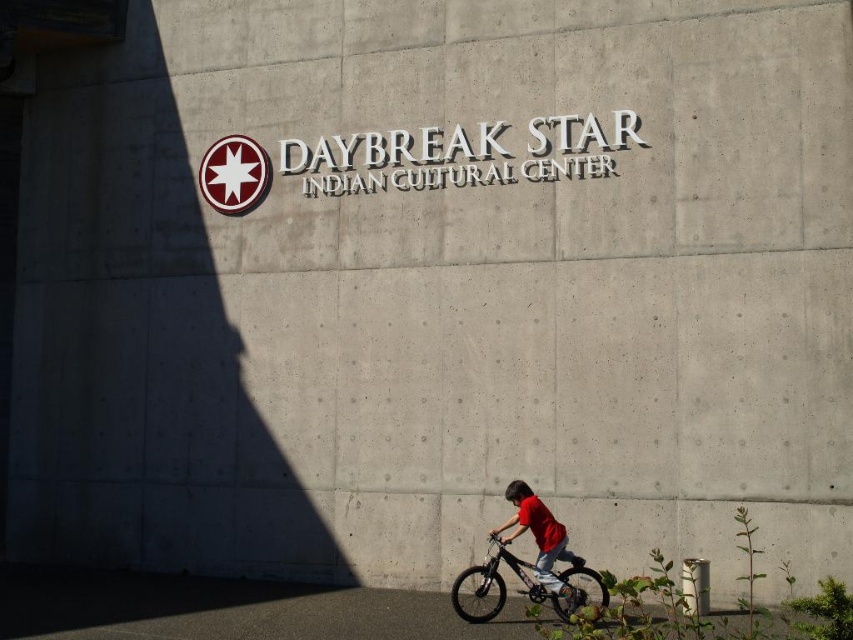
Question: Can you confirm if black matte bicycle at lower right is positioned to the right of matte red shirt at lower right?

Choices:
 (A) yes
 (B) no

Answer: (B)

Question: Among these points, which one is farthest from the camera?

Choices:
 (A) (515, 528)
 (B) (500, 554)

Answer: (A)

Question: Does black matte bicycle at lower right come behind matte red shirt at lower right?

Choices:
 (A) yes
 (B) no

Answer: (B)

Question: Is black matte bicycle at lower right positioned at the back of matte red shirt at lower right?

Choices:
 (A) yes
 (B) no

Answer: (B)